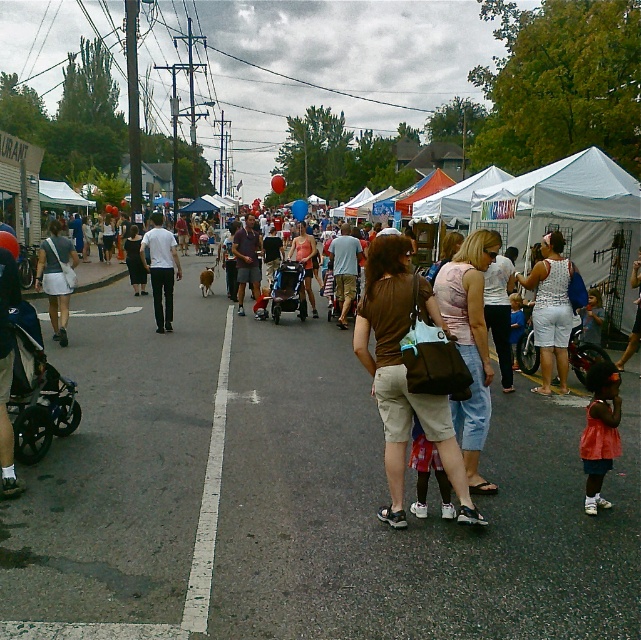
You are at the entrance of the street fair and want to find the white fabric tent at center. According to the map, your current position is at point 0.339, 0.871. Which direction should you move to reach it?

The white fabric tent at center is already at your current position, so you don not need to move.

You are a parent at the fair and want to move from your current position near the matte black stroller at left to the food stall located near the matte pink tank top at center. Can you easily walk past the stroller to reach the food stall?

Yes, you can easily walk past the matte black stroller at left to reach the matte pink tank top at center because the stroller is positioned to the left of the tank top, leaving space to the right for passage.

You are a parent at the fair with a 1.8 meters tall child. You want to walk from the matte black stroller at left to the white fabric tent at center without bending down. Is the space between them sufficient?

The white fabric tent at center is taller than the matte black stroller at left. Since the tent is taller, the clearance between them should be sufficient for a 1.8 meters tall child to walk through without bending down.